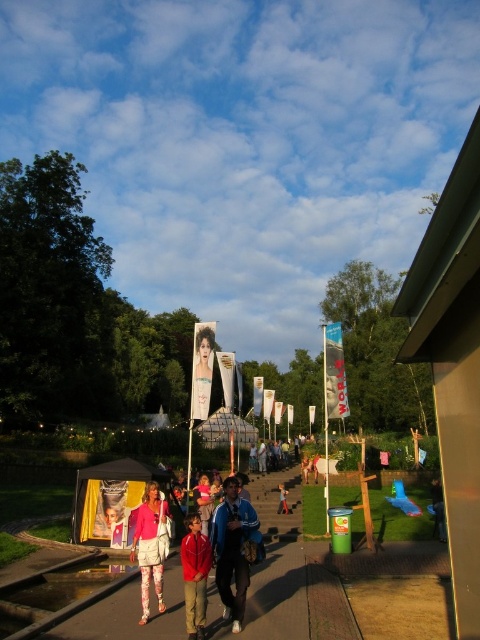
Question: Which of the following is the farthest from the observer?

Choices:
 (A) (257, 572)
 (B) (199, 541)

Answer: (A)

Question: Which object is the closest to the brown concrete pavement at center?

Choices:
 (A) smooth skin portrait at center
 (B) red matte jacket at center
 (C) reddish-brown fabric child at center
 (D) blue fabric jacket at center

Answer: (D)

Question: Which object is closer to the camera taking this photo?

Choices:
 (A) brown concrete pavement at center
 (B) matte pink dress at center

Answer: (A)

Question: Is brown concrete pavement at center wider than blue fabric jacket at center?

Choices:
 (A) yes
 (B) no

Answer: (A)

Question: Where is matte pink dress at center located in relation to reddish-brown fabric child at center in the image?

Choices:
 (A) left
 (B) right

Answer: (A)

Question: Is brown concrete pavement at center to the left of red matte jacket at center from the viewer's perspective?

Choices:
 (A) no
 (B) yes

Answer: (A)